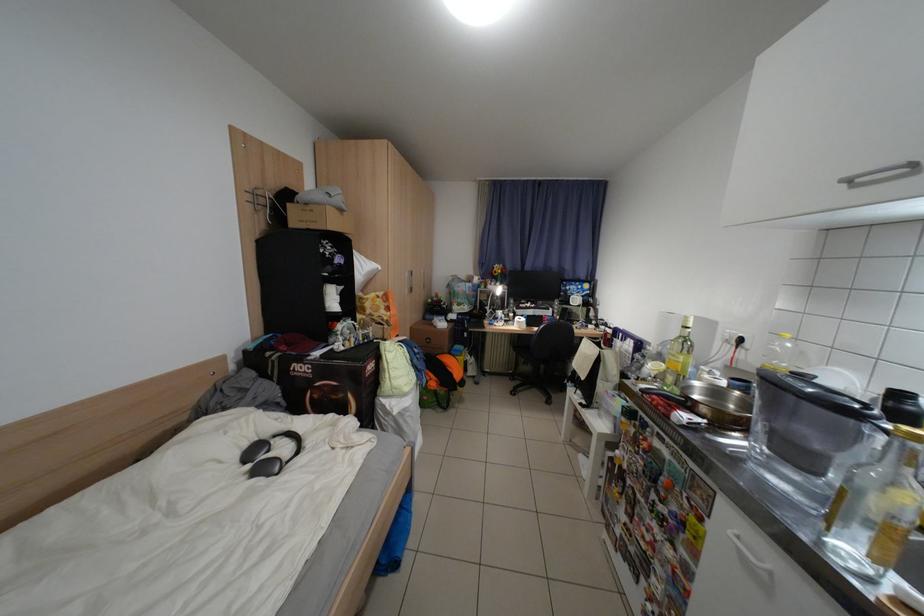
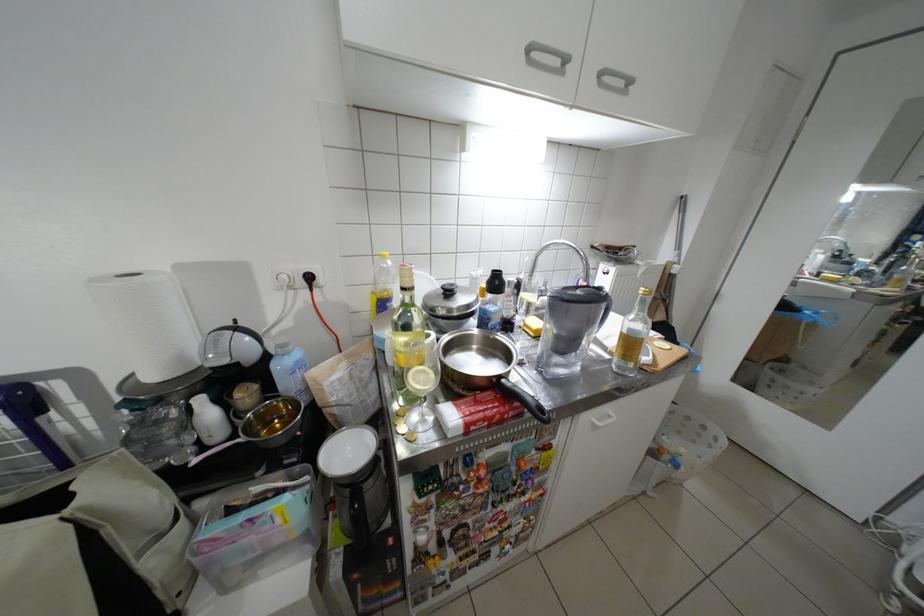
Where in the second image is the point corresponding to pixel 801 346 from the first image?

(400, 264)